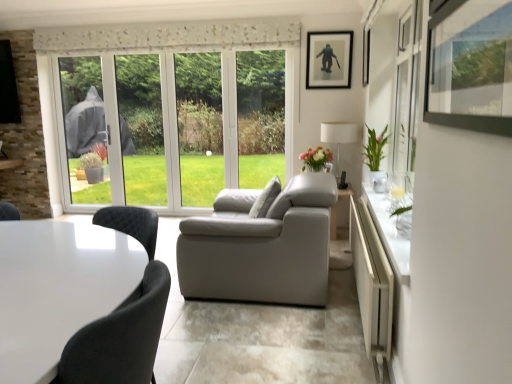
Question: Considering the relative sizes of white fabric lampshade at right and white glossy table at lower left in the image provided, is white fabric lampshade at right taller than white glossy table at lower left?

Choices:
 (A) no
 (B) yes

Answer: (B)

Question: Is white fabric lampshade at right looking in the opposite direction of white glossy table at lower left?

Choices:
 (A) no
 (B) yes

Answer: (A)

Question: Can you confirm if white fabric lampshade at right is positioned to the right of white glossy table at lower left?

Choices:
 (A) yes
 (B) no

Answer: (A)

Question: From the image's perspective, is white fabric lampshade at right on white glossy table at lower left?

Choices:
 (A) yes
 (B) no

Answer: (A)

Question: Is white fabric lampshade at right closer to camera compared to white glossy table at lower left?

Choices:
 (A) yes
 (B) no

Answer: (B)

Question: Does point (96, 274) appear closer or farther from the camera than point (271, 193)?

Choices:
 (A) closer
 (B) farther

Answer: (A)

Question: Is white glossy table at lower left taller or shorter than white fabric pillow at center?

Choices:
 (A) short
 (B) tall

Answer: (A)

Question: In the image, is white glossy table at lower left on the left side or the right side of white fabric pillow at center?

Choices:
 (A) right
 (B) left

Answer: (B)

Question: From a real-world perspective, is white glossy table at lower left physically located above or below white fabric pillow at center?

Choices:
 (A) below
 (B) above

Answer: (A)

Question: Choose the correct answer: Is matte floral arrangement at center inside green glossy vase at right or outside it?

Choices:
 (A) inside
 (B) outside

Answer: (B)

Question: From the image's perspective, relative to green glossy vase at right, is matte floral arrangement at center above or below?

Choices:
 (A) below
 (B) above

Answer: (A)

Question: From a real-world perspective, is matte floral arrangement at center positioned above or below green glossy vase at right?

Choices:
 (A) above
 (B) below

Answer: (B)

Question: Would you say matte floral arrangement at center is to the left or to the right of green glossy vase at right in the picture?

Choices:
 (A) right
 (B) left

Answer: (B)

Question: Looking at their shapes, would you say matte black picture frame at upper center is wider or thinner than matte floral arrangement at center?

Choices:
 (A) wide
 (B) thin

Answer: (B)

Question: From a real-world perspective, is matte black picture frame at upper center above or below matte floral arrangement at center?

Choices:
 (A) above
 (B) below

Answer: (A)